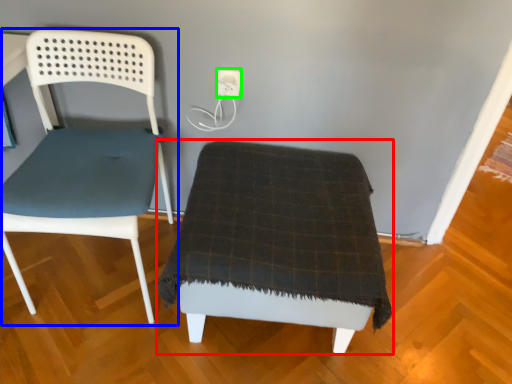
Question: Which object is positioned closest to furniture (highlighted by a red box)? Select from chair (highlighted by a blue box) and electric outlet (highlighted by a green box).

Choices:
 (A) chair
 (B) electric outlet

Answer: (A)